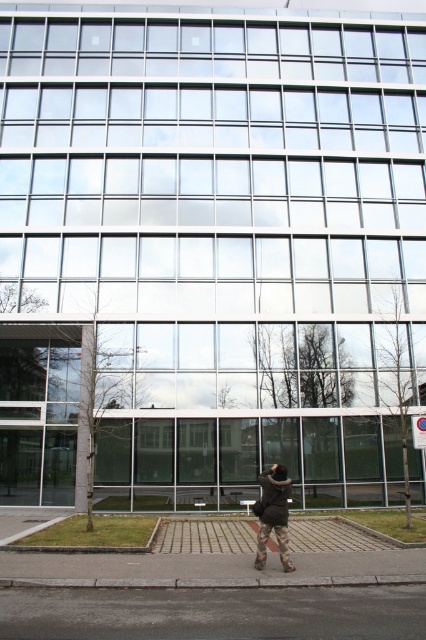
Question: Which point appears closest to the camera in this image?

Choices:
 (A) (307, 634)
 (B) (290, 584)

Answer: (A)

Question: Is gray asphalt at lower center to the left of gray concrete curb at lower center from the viewer's perspective?

Choices:
 (A) yes
 (B) no

Answer: (B)

Question: Among these points, which one is farthest from the camera?

Choices:
 (A) (319, 582)
 (B) (198, 612)

Answer: (A)

Question: Can you confirm if gray asphalt at lower center is positioned to the right of gray concrete curb at lower center?

Choices:
 (A) yes
 (B) no

Answer: (A)

Question: Is gray asphalt at lower center smaller than gray concrete curb at lower center?

Choices:
 (A) yes
 (B) no

Answer: (B)